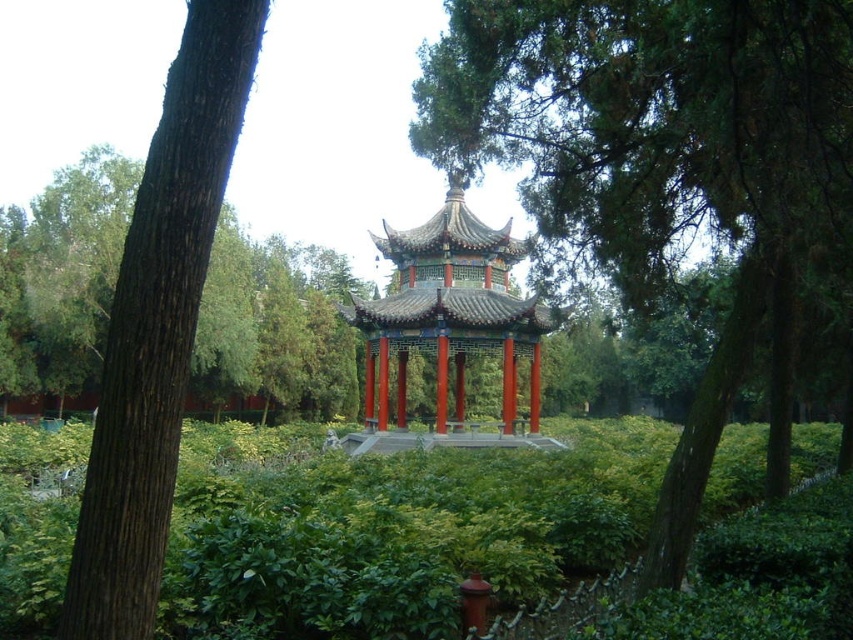
Between brown rough bark tree at left and green rough bark tree at left, which one has less height?

brown rough bark tree at left is shorter.

Does point (161, 531) come closer to viewer compared to point (354, 285)?

Yes, it is in front of point (354, 285).

Describe the element at coordinates (158, 324) in the screenshot. The width and height of the screenshot is (853, 640). I see `brown rough bark tree at left` at that location.

Where is `brown rough bark tree at left`? brown rough bark tree at left is located at coordinates (158, 324).

This screenshot has width=853, height=640. Describe the element at coordinates (158, 324) in the screenshot. I see `brown rough bark tree at left` at that location.

Does brown rough bark tree at left come behind shiny red gazebo at center?

That is False.

Is point (189, 368) more distant than point (412, 291)?

No.

Image resolution: width=853 pixels, height=640 pixels. Identify the location of brown rough bark tree at left. (158, 324).

Between green rough bark tree at left and shiny red gazebo at center, which one appears on the right side from the viewer's perspective?

shiny red gazebo at center is more to the right.

Is green rough bark tree at left above shiny red gazebo at center?

Indeed, green rough bark tree at left is positioned over shiny red gazebo at center.

This screenshot has width=853, height=640. I want to click on green rough bark tree at left, so (x=274, y=326).